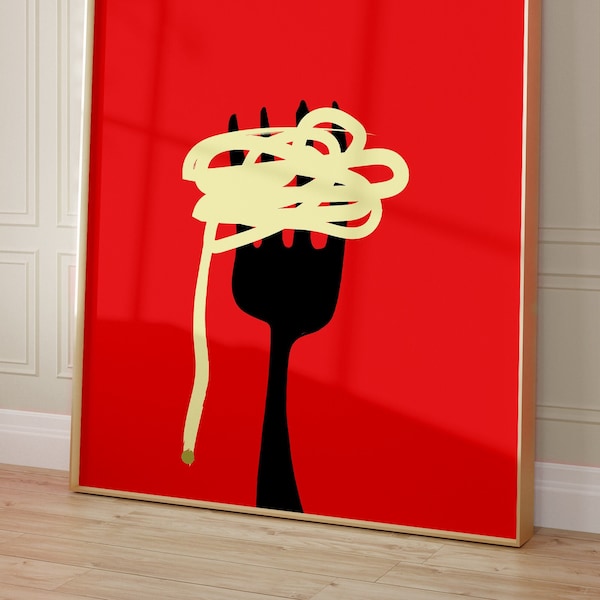
I want to click on red background on artwork, so click(134, 74).